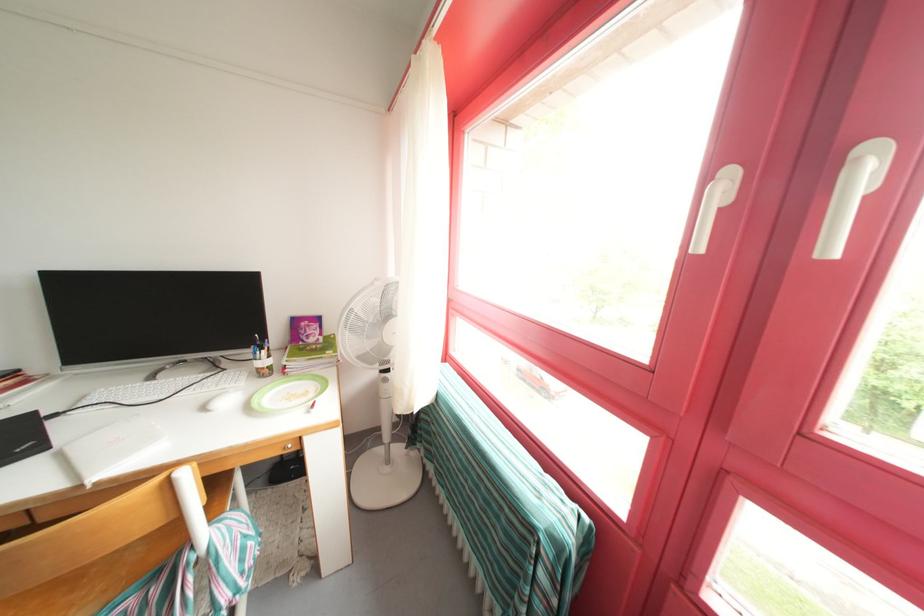
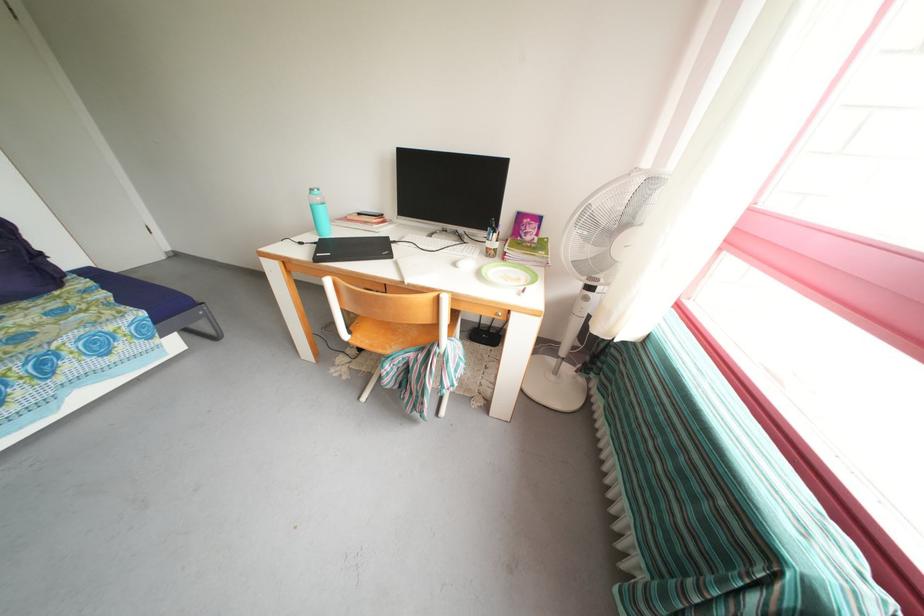
In the second image, find the point that corresponds to the point at 380,379 in the first image.

(582, 293)